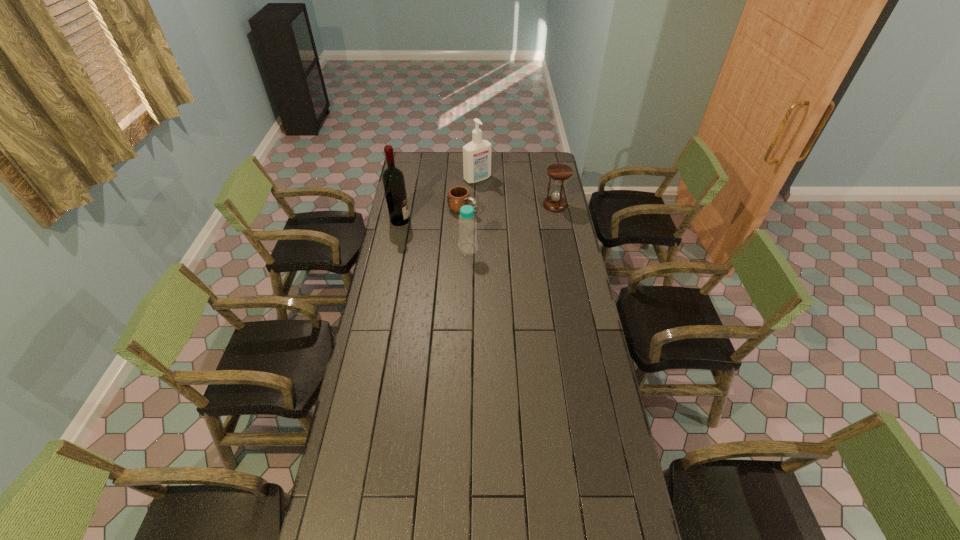
The width and height of the screenshot is (960, 540). What are the coordinates of `vacant space on the desktop that is between the nearest object and the hourglass and is positioned on the front label of the fourth shortest object` in the screenshot? It's located at (522, 221).

At what (x,y) coordinates should I click in order to perform the action: click on vacant space on the desktop that is between the nearest object and the rightmost object and is positioned on the side of the shortest object with the handle. Please return your answer as a coordinate pair (x, y). This screenshot has width=960, height=540. Looking at the image, I should click on (504, 231).

Locate an element on the screen. This screenshot has width=960, height=540. free spot on the desktop that is between the bottle and the hourglass and is positioned on the front and back of the leftmost object is located at coordinates (501, 232).